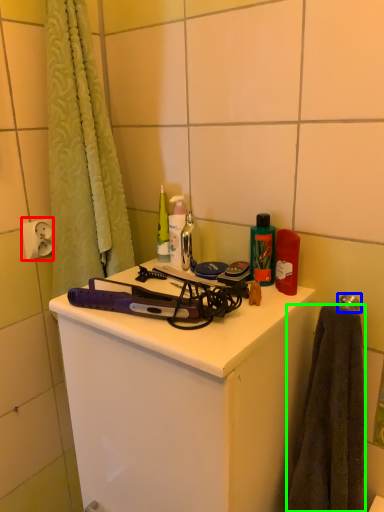
Question: Which object is positioned farthest from electric outlet (highlighted by a red box)? Select from towel bar (highlighted by a blue box) and towel/napkin (highlighted by a green box).

Choices:
 (A) towel bar
 (B) towel/napkin

Answer: (B)